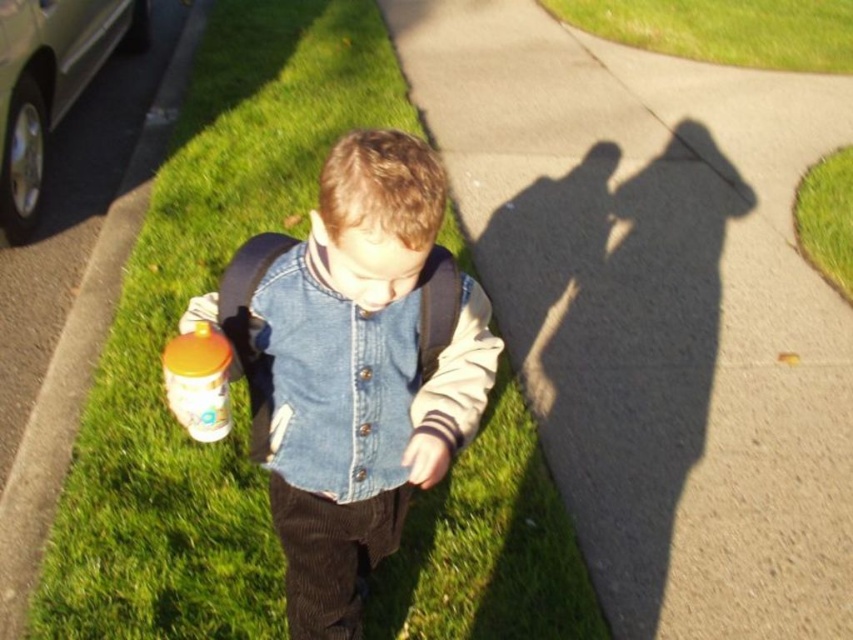
Who is higher up, green grass at lower left or denim jacket at center?

Positioned higher is green grass at lower left.

Who is more forward, [111,536] or [384,312]?

Positioned in front is point [384,312].

Where is `green grass at lower left`? Image resolution: width=853 pixels, height=640 pixels. green grass at lower left is located at coordinates (172, 330).

Locate an element on the screen. silver metallic car at upper left is located at coordinates (49, 84).

Does silver metallic car at upper left come behind green grass at upper right?

No, silver metallic car at upper left is closer to the viewer.

Locate an element on the screen. This screenshot has width=853, height=640. silver metallic car at upper left is located at coordinates (49, 84).

Is the position of green grass at lower left more distant than that of denim vest at center?

Yes, it is behind denim vest at center.

Is green grass at lower left below denim vest at center?

No.

Is point (212, 552) more distant than point (337, 224)?

That is True.

At what (x,y) coordinates should I click in order to perform the action: click on green grass at lower left. Please return your answer as a coordinate pair (x, y). Looking at the image, I should click on (172, 330).